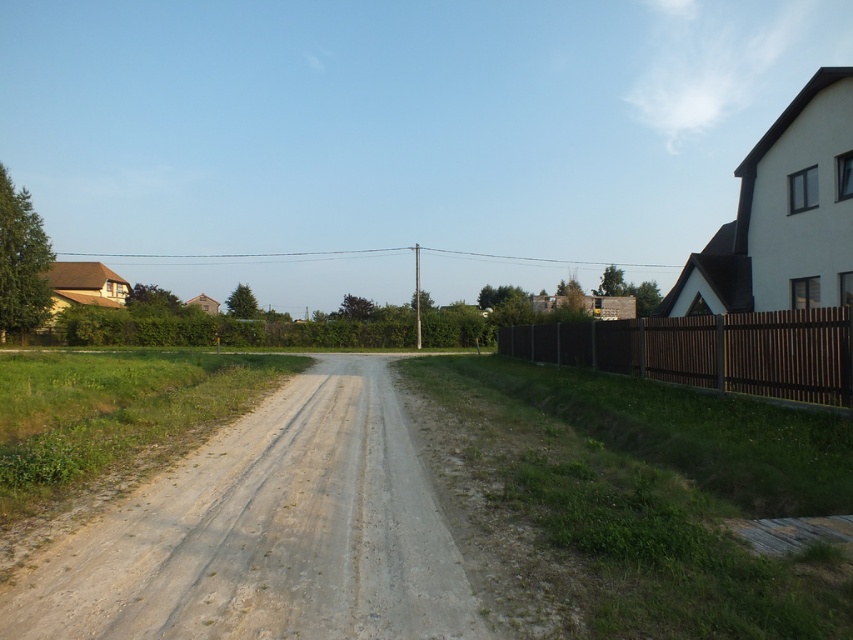
You are driving a tractor that is 2 meters wide. You need to pass through the gray gravel road at center and the brown wooden fence at right. Which path can your tractor safely pass through without going off the path?

The gray gravel road at center is thinner than brown wooden fence at right. Since the tractor is 2 meters wide, it can safely pass through the brown wooden fence at right, which is wider, but cannot pass through the gray gravel road at center as it is narrower than the tractor.

You are driving a car that is 2 meters wide. You need to turn left onto a narrower path. Can your car fit between the gray gravel road at center and the brown wooden fence at right?

The gray gravel road at center is positioned on the left side of the brown wooden fence at right. The distance between them is not specified, so it is uncertain if the car can fit. Please check the space before proceeding.